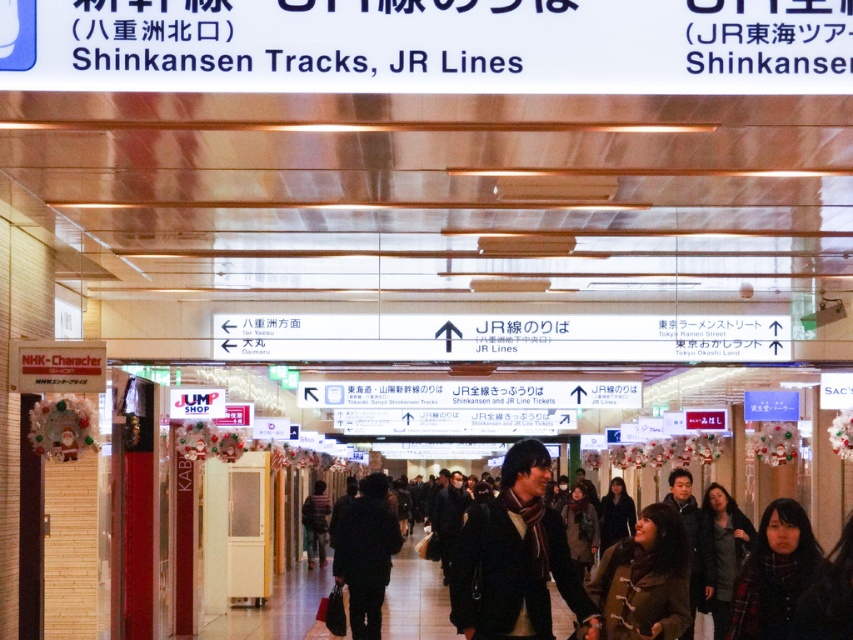
Describe the element at coordinates (366, 554) in the screenshot. I see `dark gray fabric jacket at center` at that location.

Does dark gray fabric jacket at center have a lesser height compared to dark gray wool coat at lower right?

No.

Between point (354, 515) and point (711, 508), which one is positioned behind?

The point (354, 515) is behind.

Image resolution: width=853 pixels, height=640 pixels. I want to click on dark gray fabric jacket at center, so click(x=366, y=554).

Is brown leather jacket at lower right smaller than dark brown leather coat at center?

Indeed, brown leather jacket at lower right has a smaller size compared to dark brown leather coat at center.

Is brown leather jacket at lower right positioned behind dark brown leather coat at center?

That is False.

Locate an element on the screen. The height and width of the screenshot is (640, 853). brown leather jacket at lower right is located at coordinates (643, 579).

Between brown leather jacket at lower right and dark gray fabric jacket at center, which one is positioned lower?

dark gray fabric jacket at center

Can you confirm if brown leather jacket at lower right is bigger than dark gray fabric jacket at center?

No.

This screenshot has height=640, width=853. Identify the location of brown leather jacket at lower right. (643, 579).